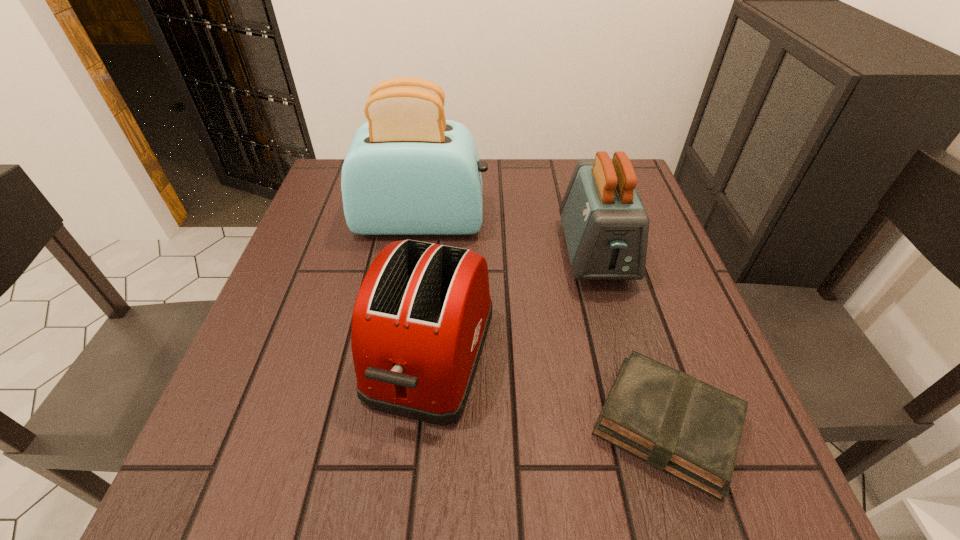
In the image, there is a desktop. In order to click on vacant space at the near right corner in this screenshot , I will do click(x=760, y=496).

Image resolution: width=960 pixels, height=540 pixels. What are the coordinates of `empty space that is in between the nearest toaster and the rightmost toaster` in the screenshot? It's located at (514, 303).

Locate an element on the screen. blank region between the tallest object and the rightmost toaster is located at coordinates (x=509, y=237).

You are a GUI agent. You are given a task and a screenshot of the screen. Output one action in this format:
    pyautogui.click(x=<x>, y=<y>)
    Task: Click on the unoccupied position between the nearest toaster and the rightmost toaster
    The image size is (960, 540).
    Given the screenshot: What is the action you would take?
    pyautogui.click(x=514, y=303)

Identify the location of vacant space that is in between the nearest toaster and the shortest object. The image size is (960, 540). (549, 389).

Identify the location of free space between the tallest toaster and the shortest object. (544, 323).

You are a GUI agent. You are given a task and a screenshot of the screen. Output one action in this format:
    pyautogui.click(x=<x>, y=<y>)
    Task: Click on the blank region between the tallest toaster and the shortest object
    Image resolution: width=960 pixels, height=540 pixels.
    Given the screenshot: What is the action you would take?
    pyautogui.click(x=544, y=323)

Locate which object ranks second in proximity to the rightmost toaster. Please provide its 2D coordinates. Your answer should be formatted as a tuple, i.e. [(x, y)], where the tuple contains the x and y coordinates of a point satisfying the conditions above.

[(409, 171)]

Choose which object is the second nearest neighbor to the nearest toaster. Please provide its 2D coordinates. Your answer should be formatted as a tuple, i.e. [(x, y)], where the tuple contains the x and y coordinates of a point satisfying the conditions above.

[(409, 171)]

Locate an element on the screen. toaster object that ranks as the closest to the shortest object is located at coordinates (420, 320).